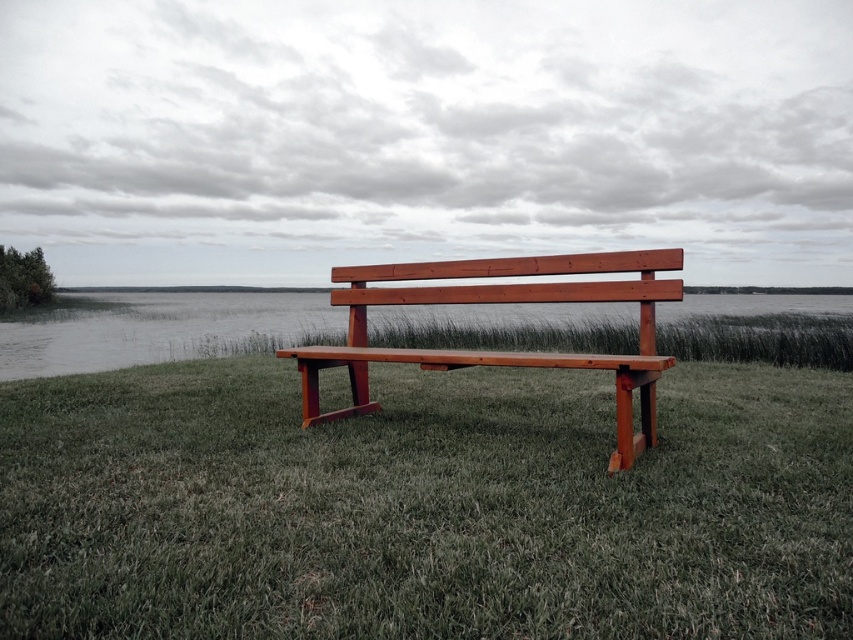
Is green grass at center taller than wooden bench at center?

Incorrect, green grass at center's height is not larger of wooden bench at center's.

Can you confirm if green grass at center is wider than wooden bench at center?

No.

Is point (80, 442) positioned in front of point (625, 292)?

Yes, point (80, 442) is closer to viewer.

The width and height of the screenshot is (853, 640). What are the coordinates of `green grass at center` in the screenshot? It's located at (422, 506).